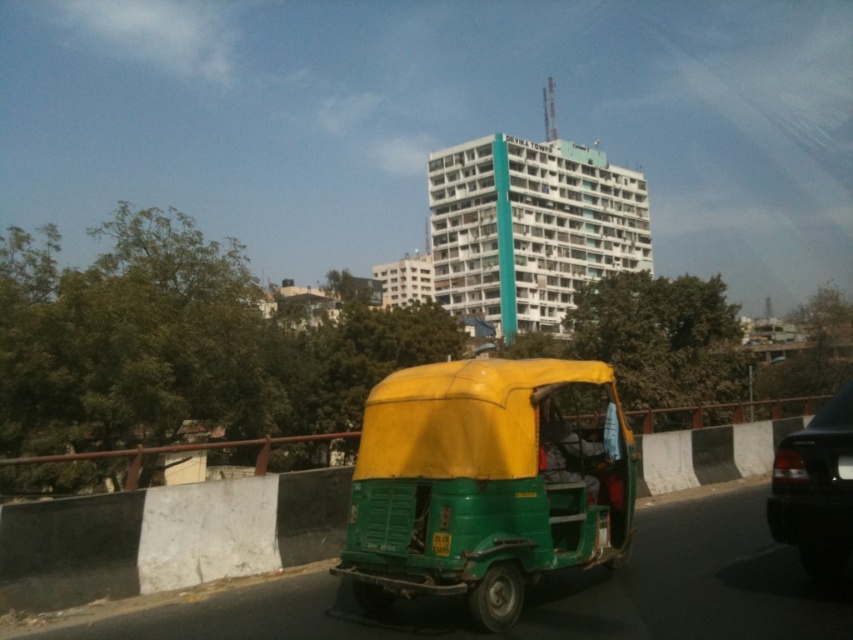
Is green matte auto-rickshaw at center to the right of black glossy car at right from the viewer's perspective?

In fact, green matte auto-rickshaw at center is to the left of black glossy car at right.

This screenshot has width=853, height=640. What do you see at coordinates (485, 484) in the screenshot?
I see `green matte auto-rickshaw at center` at bounding box center [485, 484].

Image resolution: width=853 pixels, height=640 pixels. What do you see at coordinates (485, 484) in the screenshot?
I see `green matte auto-rickshaw at center` at bounding box center [485, 484].

Where is `green matte auto-rickshaw at center`? The height and width of the screenshot is (640, 853). green matte auto-rickshaw at center is located at coordinates (485, 484).